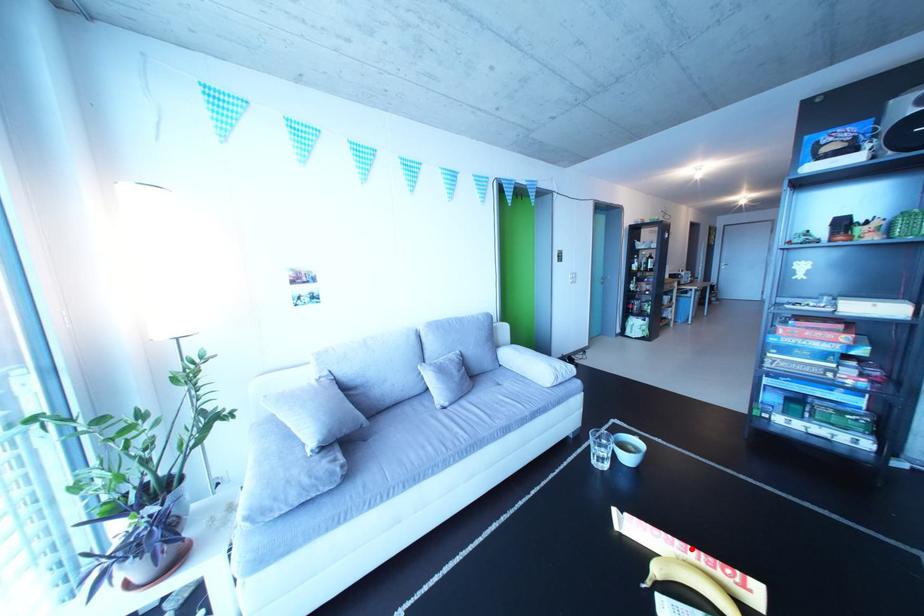
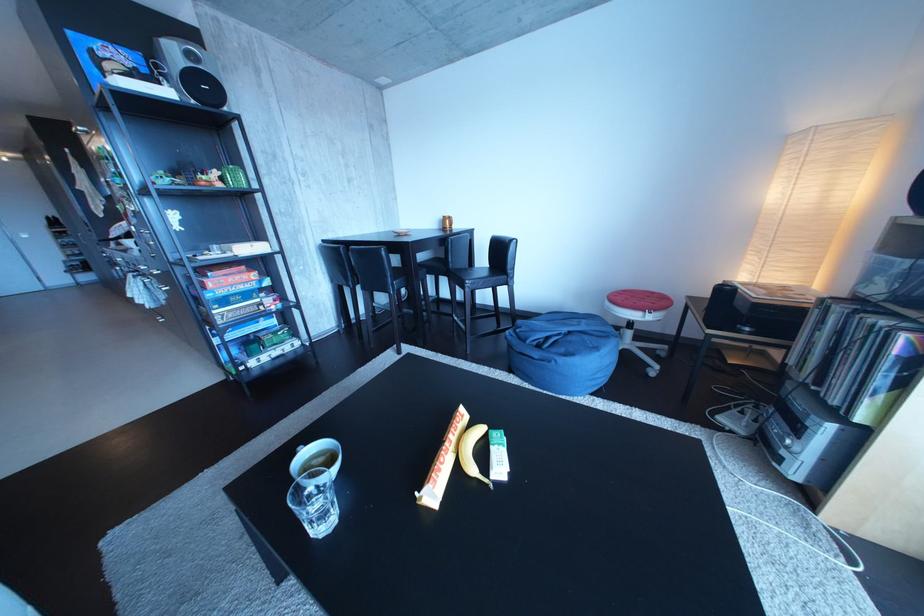
The point at the highlighted location is marked in the first image. Where is the corresponding point in the second image?

(459, 450)